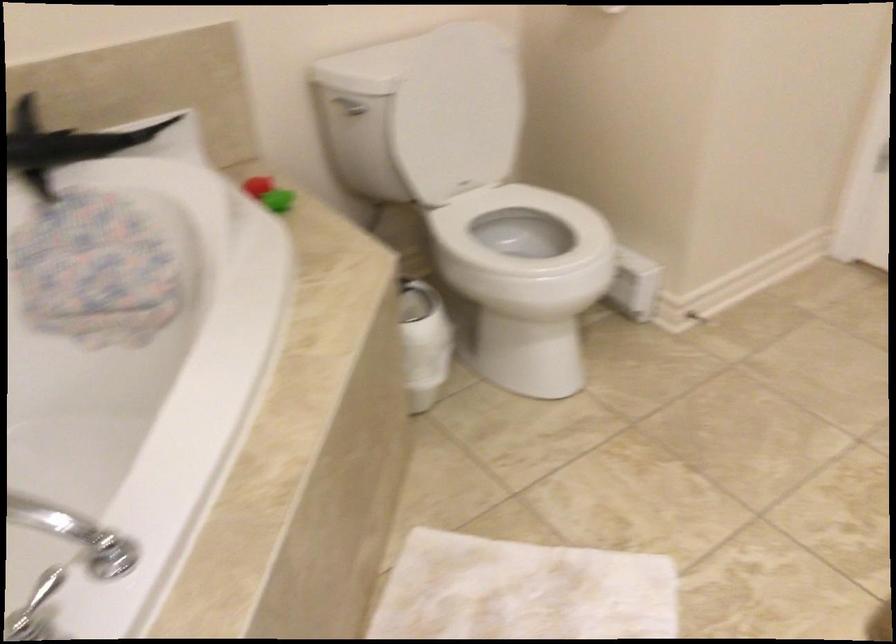
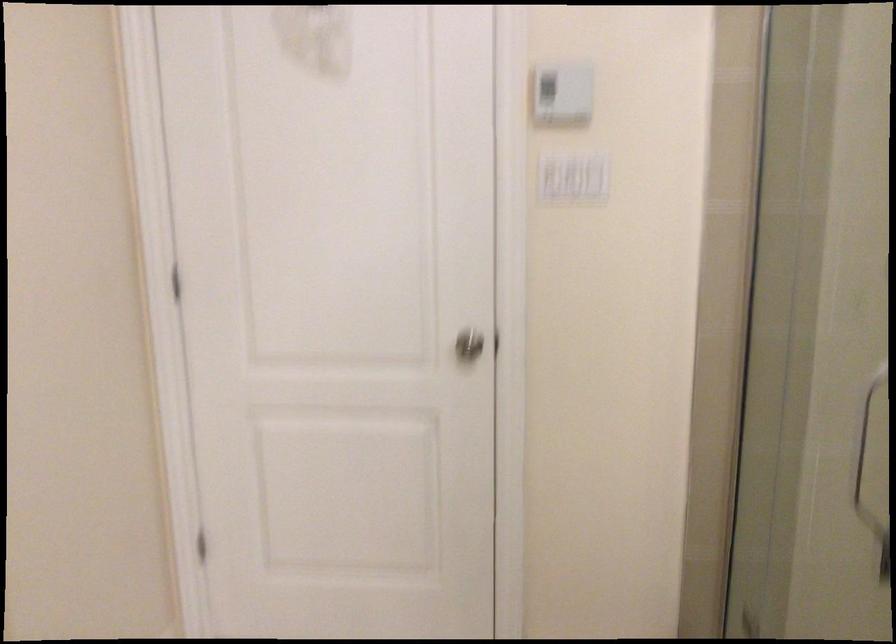
Question: The camera is either moving clockwise (left) or counter-clockwise (right) around the object. The first image is from the beginning of the video and the second image is from the end. Is the camera moving left or right when shooting the video?

Choices:
 (A) Left
 (B) Right

Answer: (A)